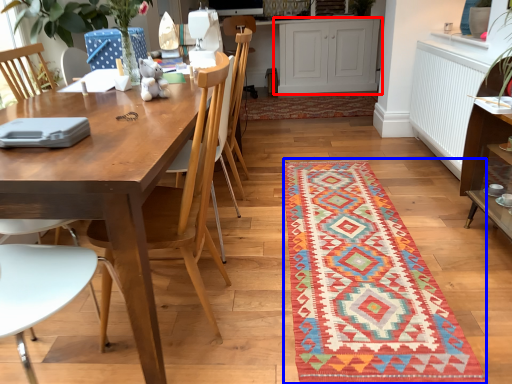
Question: Among these objects, which one is farthest to the camera, cabinetry (highlighted by a red box) or mat (highlighted by a blue box)?

Choices:
 (A) cabinetry
 (B) mat

Answer: (A)